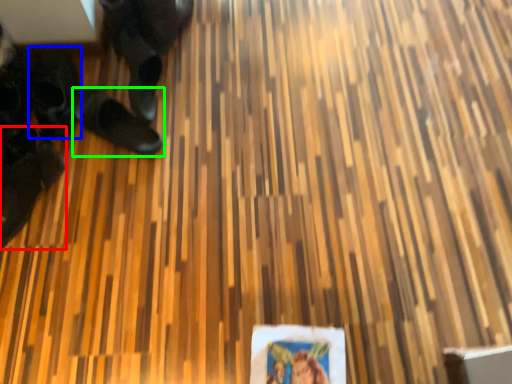
Question: Which object is the farthest from footwear (highlighted by a red box)? Choose among these: footwear (highlighted by a blue box) or footwear (highlighted by a green box).

Choices:
 (A) footwear
 (B) footwear

Answer: (B)